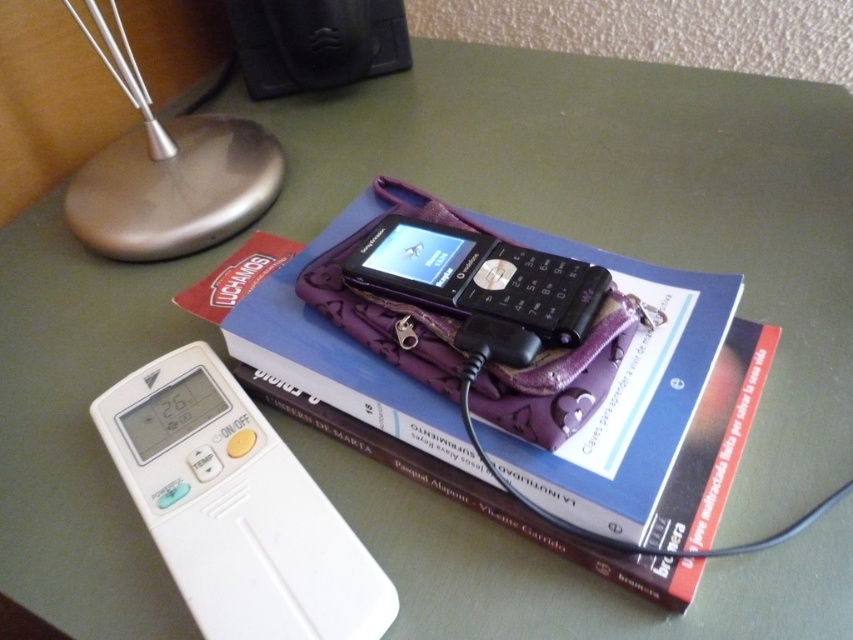
You have a blue hardcover book at center and a black plastic phone at center on a desk. Which object has a greater width?

The blue hardcover book at center has a greater width than the black plastic phone at center.

You are organizing items on a desk and need to place a new item between the blue hardcover book at center and the satin silver base at upper left. Based on their positions, where should you place the new item?

The blue hardcover book at center is located below the satin silver base at upper left, so you should place the new item between them in the space between the lower position of the blue hardcover book at center and the upper position of the satin silver base at upper left.

You are organizing your desk and want to place both the white plastic ipod at lower left and the black plastic phone at center into a drawer. The drawer has a width of 15 cm. Given their sizes, can both items fit side by side in the drawer?

The white plastic ipod at lower left is larger in size than the black plastic phone at center. However, without specific measurements of their widths, it is impossible to determine if they can fit side by side in a 15 cm drawer.